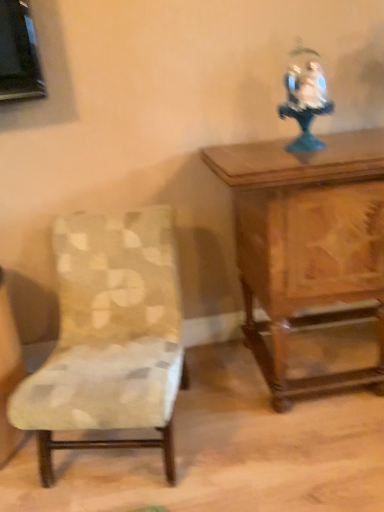
Question: Does wooden carved table at upper right have a larger size compared to white porcelain figurine at upper right?

Choices:
 (A) no
 (B) yes

Answer: (B)

Question: Can white porcelain figurine at upper right be found inside wooden carved table at upper right?

Choices:
 (A) yes
 (B) no

Answer: (B)

Question: From the image's perspective, is wooden carved table at upper right on top of white porcelain figurine at upper right?

Choices:
 (A) yes
 (B) no

Answer: (B)

Question: Does wooden carved table at upper right have a lesser width compared to white porcelain figurine at upper right?

Choices:
 (A) no
 (B) yes

Answer: (A)

Question: Is white porcelain figurine at upper right at the back of wooden carved table at upper right?

Choices:
 (A) no
 (B) yes

Answer: (A)

Question: Is the position of wooden carved table at upper right less distant than that of white porcelain figurine at upper right?

Choices:
 (A) yes
 (B) no

Answer: (A)

Question: Can you confirm if patterned fabric chair at left is shorter than wooden carved table at upper right?

Choices:
 (A) no
 (B) yes

Answer: (B)

Question: Can you confirm if patterned fabric chair at left is wider than wooden carved table at upper right?

Choices:
 (A) yes
 (B) no

Answer: (A)

Question: Is patterned fabric chair at left further to the viewer compared to wooden carved table at upper right?

Choices:
 (A) yes
 (B) no

Answer: (B)

Question: From a real-world perspective, is patterned fabric chair at left positioned over wooden carved table at upper right based on gravity?

Choices:
 (A) yes
 (B) no

Answer: (B)

Question: Is patterned fabric chair at left bigger than wooden carved table at upper right?

Choices:
 (A) yes
 (B) no

Answer: (B)

Question: Is patterned fabric chair at left outside wooden carved table at upper right?

Choices:
 (A) no
 (B) yes

Answer: (B)

Question: Would you consider patterned fabric chair at left to be distant from white porcelain figurine at upper right?

Choices:
 (A) no
 (B) yes

Answer: (A)